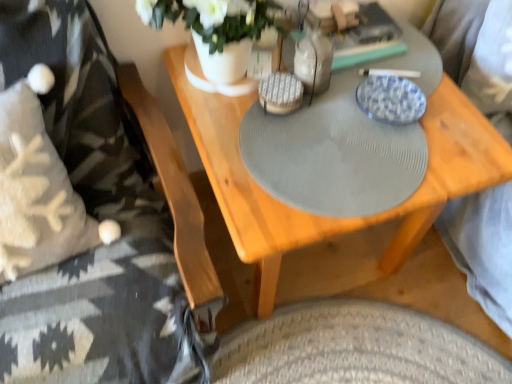
This screenshot has height=384, width=512. Find the location of `free space to the left of blue glazed plate at upper center`. free space to the left of blue glazed plate at upper center is located at coordinates (322, 118).